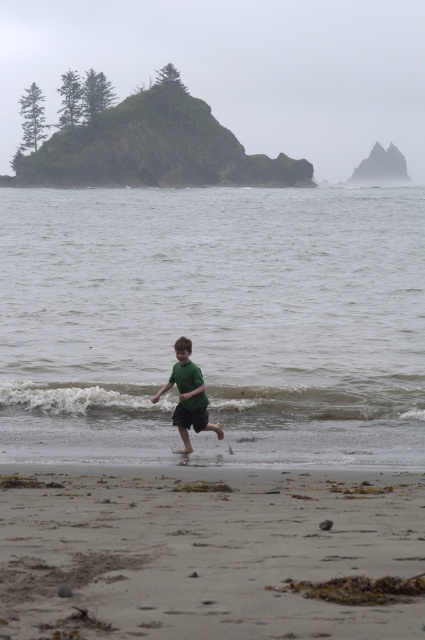
Question: Estimate the real-world distances between objects in this image. Which object is closer to the sandy at lower center?

Choices:
 (A) green matte water at lower center
 (B) green matte shirt at center

Answer: (B)

Question: Which point is closer to the camera taking this photo?

Choices:
 (A) (186, 381)
 (B) (223, 474)

Answer: (B)

Question: Can you confirm if sandy at lower center is bigger than green matte shirt at center?

Choices:
 (A) no
 (B) yes

Answer: (A)

Question: Which of the following is the closest to the observer?

Choices:
 (A) (62, 580)
 (B) (319, 400)
 (C) (166, 387)

Answer: (A)

Question: Is the position of sandy at lower center more distant than that of green matte shirt at center?

Choices:
 (A) yes
 (B) no

Answer: (B)

Question: Is green matte water at lower center closer to camera compared to green matte shirt at center?

Choices:
 (A) yes
 (B) no

Answer: (B)